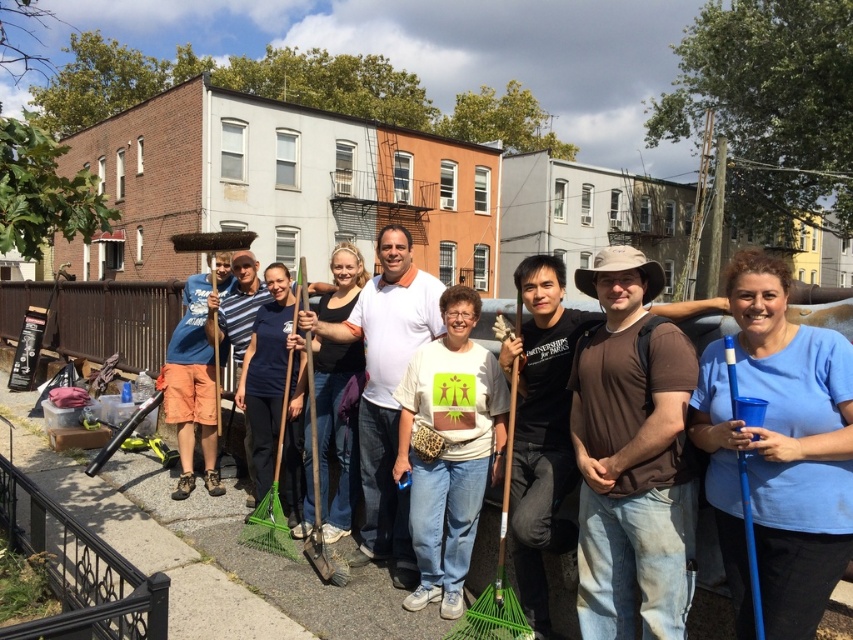
Question: Which of the following is the closest to the observer?

Choices:
 (A) blue matte shirt at center
 (B) white t-shirt at center

Answer: (A)

Question: Which of the following is the farthest from the observer?

Choices:
 (A) blue matte shirt at center
 (B) white t-shirt at center

Answer: (B)

Question: Is blue matte shirt at center above white t-shirt at center?

Choices:
 (A) no
 (B) yes

Answer: (B)

Question: Is blue matte shirt at center to the right of white t-shirt at center from the viewer's perspective?

Choices:
 (A) no
 (B) yes

Answer: (B)

Question: Observing the image, what is the correct spatial positioning of blue matte shirt at center in reference to white t-shirt at center?

Choices:
 (A) above
 (B) below

Answer: (A)

Question: Which object is closer to the camera taking this photo?

Choices:
 (A) white t-shirt at center
 (B) blue matte shirt at center

Answer: (B)